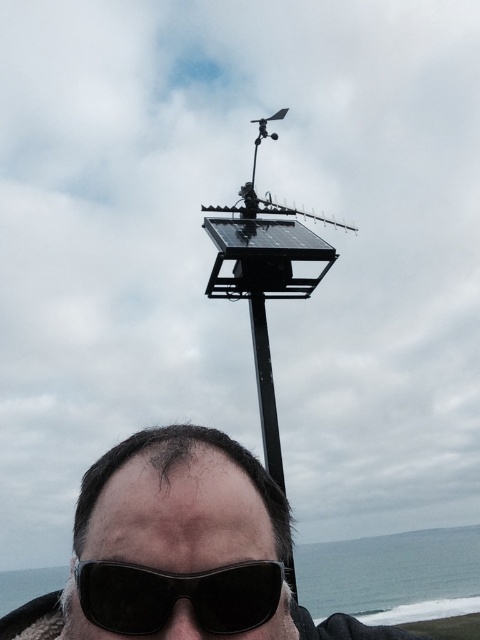
Is black matte sunglasses at center to the left of black matte sunglasses at lower center from the viewer's perspective?

Indeed, black matte sunglasses at center is positioned on the left side of black matte sunglasses at lower center.

Describe the element at coordinates (169, 544) in the screenshot. This screenshot has height=640, width=480. I see `black matte sunglasses at center` at that location.

Where is `black matte sunglasses at center`? This screenshot has width=480, height=640. black matte sunglasses at center is located at coordinates 169,544.